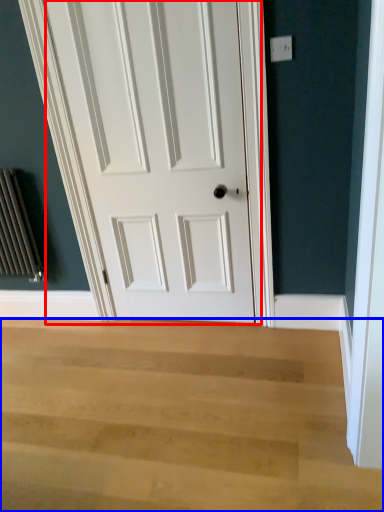
Question: Which point is further to the camera, door (highlighted by a red box) or stairwell (highlighted by a blue box)?

Choices:
 (A) door
 (B) stairwell

Answer: (A)